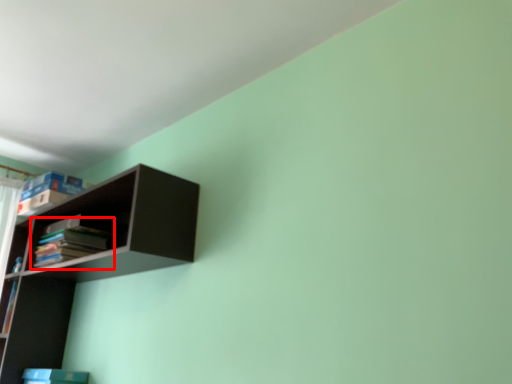
Question: Observing the image, what is the correct spatial positioning of book (annotated by the red box) in reference to shelf?

Choices:
 (A) left
 (B) right

Answer: (A)